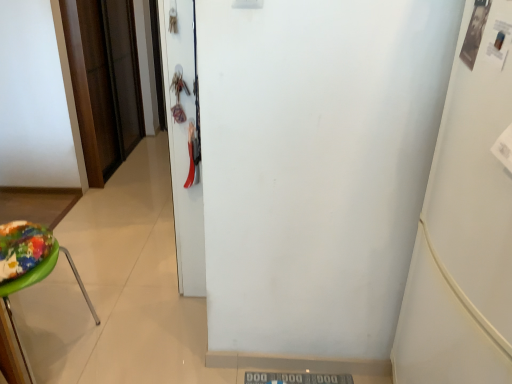
You are a GUI agent. You are given a task and a screenshot of the screen. Output one action in this format:
    pyautogui.click(x=<x>, y=<y>)
    Task: Click on the white glossy door at center, positioned as the second door in back-to-front order
    This screenshot has width=512, height=384.
    Given the screenshot: What is the action you would take?
    pyautogui.click(x=183, y=145)

Locate an element on the screen. green plastic stool at left is located at coordinates (33, 268).

You are a GUI agent. You are given a task and a screenshot of the screen. Output one action in this format:
    pyautogui.click(x=<x>, y=<y>)
    Task: Click on the white matte refrigerator at right
    The image size is (512, 384).
    Given the screenshot: What is the action you would take?
    pyautogui.click(x=464, y=231)

Is green plastic stool at left completely or partially outside of white glossy door at center, which appears as the 2th door when viewed from the left?

Absolutely, green plastic stool at left is external to white glossy door at center, which appears as the 2th door when viewed from the left.

Is green plastic stool at left looking in the opposite direction of white glossy door at center, positioned as the second door in back-to-front order?

No, green plastic stool at left's orientation is not away from white glossy door at center, positioned as the second door in back-to-front order.

From the image's perspective, which is above, green plastic stool at left or white glossy door at center, the 1th door in the front-to-back sequence?

From the image's view, white glossy door at center, the 1th door in the front-to-back sequence, is above.

Can you tell me how much green plastic stool at left and white glossy door at center, positioned as the second door in back-to-front order, differ in facing direction?

They differ by 179 degrees in their facing directions.

How distant is white glossy door at center, the 1th door in the front-to-back sequence, from brown wood door at left, marked as the first door in a left-to-right arrangement?

white glossy door at center, the 1th door in the front-to-back sequence, and brown wood door at left, marked as the first door in a left-to-right arrangement, are 1.58 meters apart.

Considering their positions, is white glossy door at center, which is the 1th door in right-to-left order, located in front of or behind brown wood door at left, marked as the first door in a left-to-right arrangement?

Visually, white glossy door at center, which is the 1th door in right-to-left order, is located in front of brown wood door at left, marked as the first door in a left-to-right arrangement.

Considering the sizes of white glossy door at center, which is the 1th door in right-to-left order, and brown wood door at left, marked as the first door in a left-to-right arrangement, in the image, is white glossy door at center, which is the 1th door in right-to-left order, taller or shorter than brown wood door at left, marked as the first door in a left-to-right arrangement,?

Considering their sizes, white glossy door at center, which is the 1th door in right-to-left order, has more height than brown wood door at left, marked as the first door in a left-to-right arrangement.

From the image's perspective, is white glossy door at center, positioned as the second door in back-to-front order, above or below brown wood door at left, acting as the second door starting from the front?

white glossy door at center, positioned as the second door in back-to-front order, is below brown wood door at left, acting as the second door starting from the front.

Is brown wood door at left, which is the second door in right-to-left order, situated inside green plastic stool at left or outside?

brown wood door at left, which is the second door in right-to-left order, is located beyond the bounds of green plastic stool at left.

From the image's perspective, which one is positioned higher, brown wood door at left, marked as the first door in a left-to-right arrangement, or green plastic stool at left?

brown wood door at left, marked as the first door in a left-to-right arrangement.

Considering the positions of objects brown wood door at left, marked as the first door in a left-to-right arrangement, and green plastic stool at left in the image provided, who is more to the right, brown wood door at left, marked as the first door in a left-to-right arrangement, or green plastic stool at left?

Positioned to the right is green plastic stool at left.

Is white matte refrigerator at right spatially inside white glossy door at center, the 1th door in the front-to-back sequence, or outside of it?

white matte refrigerator at right lies outside white glossy door at center, the 1th door in the front-to-back sequence.

From the image's perspective, is white matte refrigerator at right on top of white glossy door at center, the 1th door in the front-to-back sequence?

No, from the image's perspective, white matte refrigerator at right is not on top of white glossy door at center, the 1th door in the front-to-back sequence.

Does white matte refrigerator at right have a smaller size compared to white glossy door at center, which appears as the 2th door when viewed from the left?

Actually, white matte refrigerator at right might be larger than white glossy door at center, which appears as the 2th door when viewed from the left.

How many degrees apart are the facing directions of white matte refrigerator at right and white glossy door at center, positioned as the second door in back-to-front order?

The angular difference between white matte refrigerator at right and white glossy door at center, positioned as the second door in back-to-front order, is 1.93 degrees.

Considering the sizes of objects white glossy door at center, positioned as the second door in back-to-front order, and white matte refrigerator at right in the image provided, who is shorter, white glossy door at center, positioned as the second door in back-to-front order, or white matte refrigerator at right?

With less height is white glossy door at center, positioned as the second door in back-to-front order.

Which object is positioned more to the right, white glossy door at center, which appears as the 2th door when viewed from the left, or white matte refrigerator at right?

Positioned to the right is white matte refrigerator at right.

Between point (179, 163) and point (510, 51), which one is positioned in front?

The point (510, 51) is closer.

From a real-world perspective, count 1st doors downward from the white matte refrigerator at right and point to it. Please provide its 2D coordinates.

[(183, 145)]

In the image, there is a brown wood door at left, which is the second door in right-to-left order. Identify the location of furniture below it (from a real-world perspective). This screenshot has width=512, height=384. (33, 268).

Does green plastic stool at left touch brown wood door at left, which appears as the 1th door when viewed from the back?

No, green plastic stool at left is not in contact with brown wood door at left, which appears as the 1th door when viewed from the back.

Looking at the image, does green plastic stool at left seem bigger or smaller compared to brown wood door at left, marked as the first door in a left-to-right arrangement?

green plastic stool at left is bigger than brown wood door at left, marked as the first door in a left-to-right arrangement.

From the picture: How many degrees apart are the facing directions of green plastic stool at left and brown wood door at left, which is the second door in right-to-left order?

The angle between the facing direction of green plastic stool at left and the facing direction of brown wood door at left, which is the second door in right-to-left order, is 1.3 degrees.

Considering the positions of point (503, 270) and point (117, 86), is point (503, 270) closer or farther from the camera than point (117, 86)?

Point (503, 270).

Which of these two, white matte refrigerator at right or brown wood door at left, which is the second door in right-to-left order, is bigger?

Bigger between the two is white matte refrigerator at right.

From the picture: Would you say white matte refrigerator at right is a long distance from brown wood door at left, acting as the second door starting from the front?

Yes, white matte refrigerator at right is far from brown wood door at left, acting as the second door starting from the front.

From the image's perspective, between white matte refrigerator at right and brown wood door at left, which appears as the 1th door when viewed from the back, which one is located above?

brown wood door at left, which appears as the 1th door when viewed from the back, from the image's perspective.

Locate an element on the screen. furniture located underneath the white glossy door at center, which appears as the 2th door when viewed from the left (from a real-world perspective) is located at coordinates click(33, 268).

The width and height of the screenshot is (512, 384). In order to click on door lying above the white glossy door at center, which is the 1th door in right-to-left order (from the image's perspective) in this screenshot , I will do `click(104, 81)`.

Looking at the image, which one is located further to white glossy door at center, which is the 1th door in right-to-left order, green plastic stool at left or white matte refrigerator at right?

The object further to white glossy door at center, which is the 1th door in right-to-left order, is white matte refrigerator at right.

Looking at the image, which one is located further to brown wood door at left, which appears as the 1th door when viewed from the back, white glossy door at center, the 1th door in the front-to-back sequence, or green plastic stool at left?

Among the two, green plastic stool at left is located further to brown wood door at left, which appears as the 1th door when viewed from the back.

Considering their positions, is brown wood door at left, which is the second door in right-to-left order, positioned further to white glossy door at center, which appears as the 2th door when viewed from the left, than white matte refrigerator at right?

brown wood door at left, which is the second door in right-to-left order.

Considering their positions, is brown wood door at left, marked as the first door in a left-to-right arrangement, positioned closer to white glossy door at center, which appears as the 2th door when viewed from the left, than green plastic stool at left?

green plastic stool at left.

Estimate the real-world distances between objects in this image. Which object is closer to white matte refrigerator at right, green plastic stool at left or white glossy door at center, which is the 1th door in right-to-left order?

white glossy door at center, which is the 1th door in right-to-left order, is positioned closer to the anchor white matte refrigerator at right.

Looking at the image, which one is located closer to white glossy door at center, positioned as the second door in back-to-front order, white matte refrigerator at right or green plastic stool at left?

green plastic stool at left is positioned closer to the anchor white glossy door at center, positioned as the second door in back-to-front order.

Based on their spatial positions, is brown wood door at left, acting as the second door starting from the front, or green plastic stool at left closer to white matte refrigerator at right?

Among the two, green plastic stool at left is located nearer to white matte refrigerator at right.

Looking at this image, estimate the real-world distances between objects in this image. Which object is further from white glossy door at center, which appears as the 2th door when viewed from the left, white matte refrigerator at right or brown wood door at left, which appears as the 1th door when viewed from the back?

brown wood door at left, which appears as the 1th door when viewed from the back, is positioned further to the anchor white glossy door at center, which appears as the 2th door when viewed from the left.

Locate an element on the screen. The height and width of the screenshot is (384, 512). door between green plastic stool at left and white matte refrigerator at right is located at coordinates (183, 145).

The width and height of the screenshot is (512, 384). I want to click on furniture positioned between white matte refrigerator at right and brown wood door at left, which appears as the 1th door when viewed from the back, from near to far, so 33,268.

Locate an element on the screen. door positioned between green plastic stool at left and brown wood door at left, which appears as the 1th door when viewed from the back, from near to far is located at coordinates (183, 145).

Where is `door located between white matte refrigerator at right and brown wood door at left, acting as the second door starting from the front, in the depth direction`? Image resolution: width=512 pixels, height=384 pixels. door located between white matte refrigerator at right and brown wood door at left, acting as the second door starting from the front, in the depth direction is located at coordinates (183, 145).